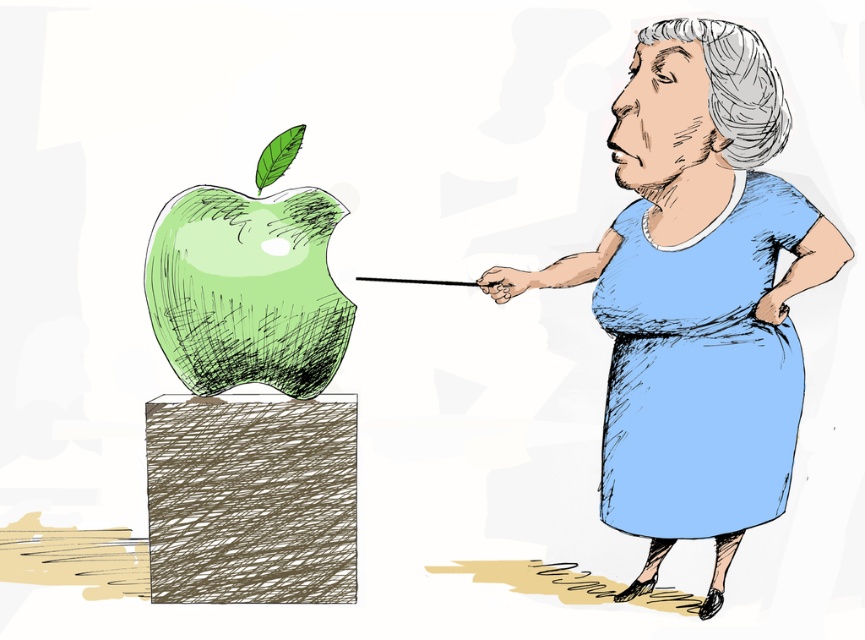
You are an artist trying to sketch the scene. You need to decide which object should be wider in your drawing. Based on the scene, which object should you make wider between the blue fabric dress at right and the green sketched apple at center?

The blue fabric dress at right should be made wider in the drawing since its width is larger than the green sketched apple at center according to the description.

You are an observer looking at the image. There is a point at coordinates (697, 296). What object in the image does this point correspond to?

The point at coordinates (697, 296) corresponds to the blue fabric dress at right.

Based on the scene description, if someone is looking directly at the green sketched apple at center, would the blue fabric dress at right be visible in their line of sight?

Yes, the blue fabric dress at right is in front of the green sketched apple at center, so it would block the view of the apple if they are looking directly at it.